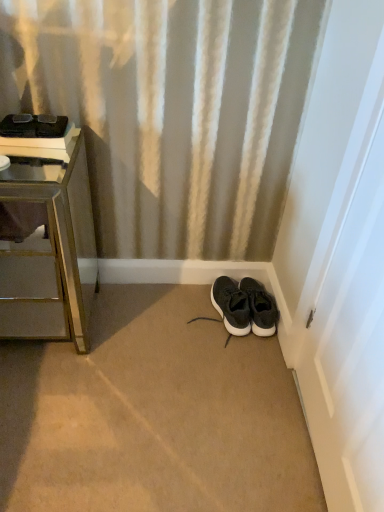
Image resolution: width=384 pixels, height=512 pixels. Identify the location of vacant area that lies between white glossy door at right and black suede sneakers at lower right, which is counted as the 1th footwear, starting from the right. (275, 380).